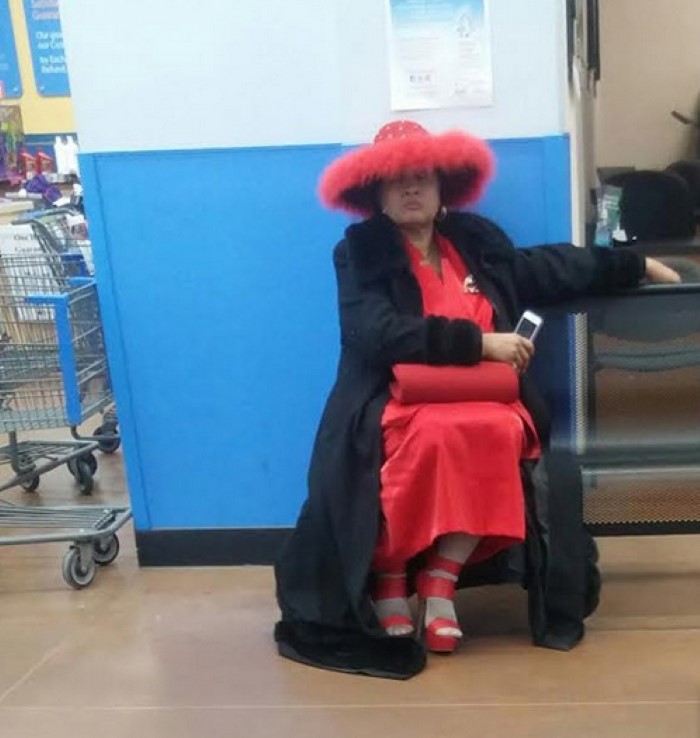
Locate an element on the screen. light blue wall is located at coordinates (220, 93).